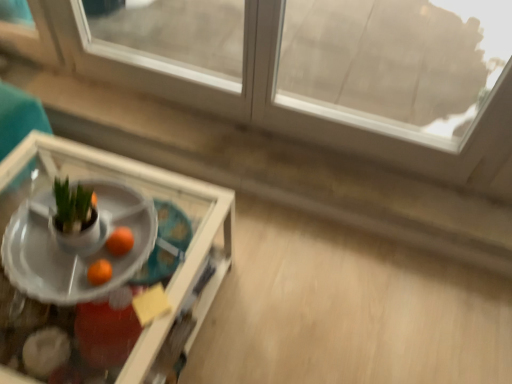
At what (x,y) coordinates should I click in order to perform the action: click on free space that is to the left of orange matte at center. Please return your answer as a coordinate pair (x, y). The image size is (512, 384). Looking at the image, I should click on (54, 252).